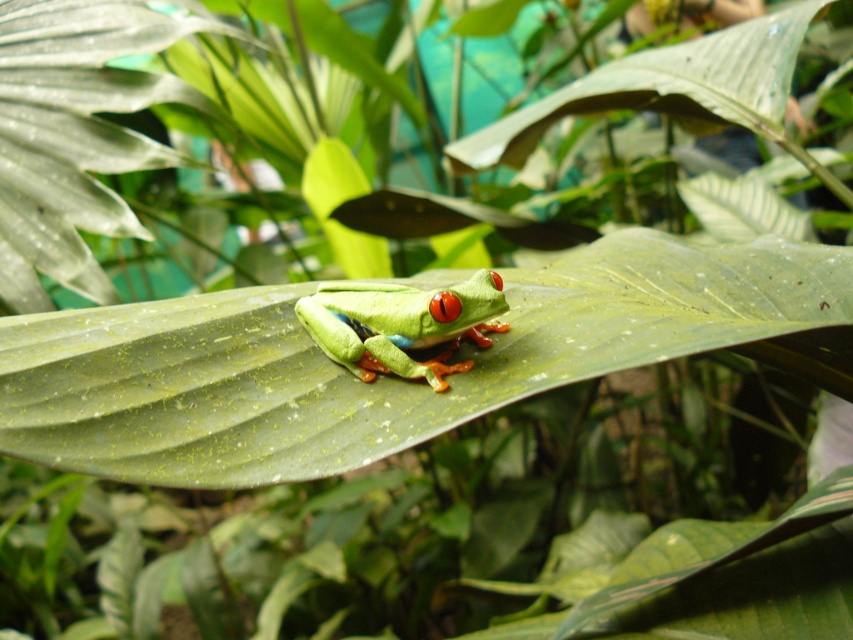
Question: Can you confirm if green matte leaf at center is smaller than green matte/frosted frog at center?

Choices:
 (A) no
 (B) yes

Answer: (A)

Question: Does green matte leaf at center have a lesser width compared to green matte/frosted frog at center?

Choices:
 (A) yes
 (B) no

Answer: (B)

Question: Which object appears closest to the camera in this image?

Choices:
 (A) green matte/frosted frog at center
 (B) green matte leaf at center

Answer: (B)

Question: Can you confirm if green matte leaf at center is smaller than green matte/frosted frog at center?

Choices:
 (A) yes
 (B) no

Answer: (B)

Question: Which of the following is the closest to the observer?

Choices:
 (A) (444, 326)
 (B) (308, 292)

Answer: (A)